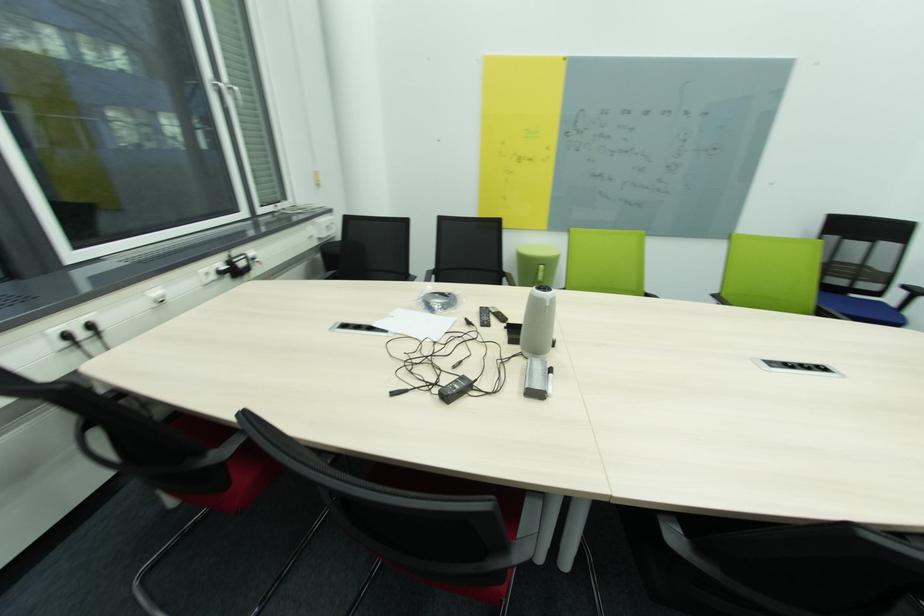
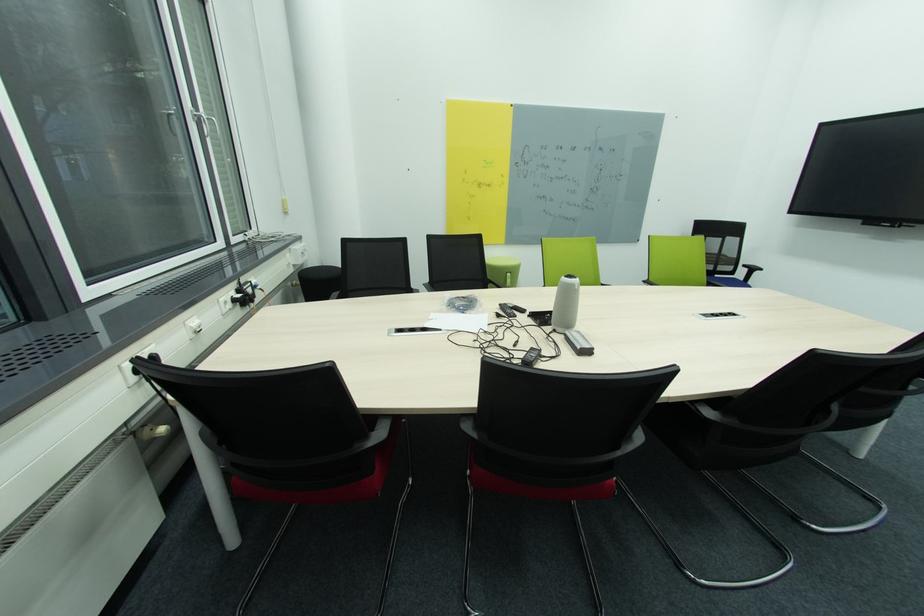
Locate, in the second image, the point that corresponds to pixel 414 309 in the first image.

(444, 313)